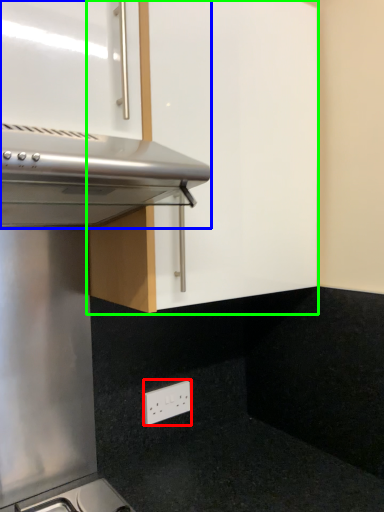
Question: Which object is positioned closest to electric outlet (highlighted by a red box)? Select from oven (highlighted by a blue box) and cabinetry (highlighted by a green box).

Choices:
 (A) oven
 (B) cabinetry

Answer: (B)